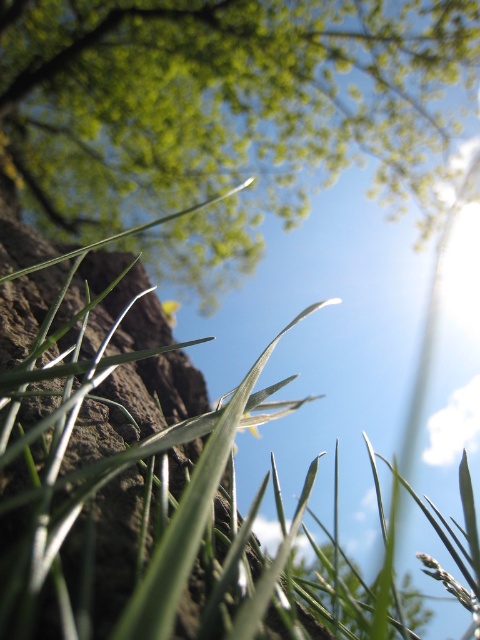
Question: Does green leafy grass at lower left appear on the left side of green leafy tree at center?

Choices:
 (A) no
 (B) yes

Answer: (B)

Question: Which point is closer to the camera?

Choices:
 (A) green leafy tree at center
 (B) green leafy grass at lower left

Answer: (B)

Question: Can you confirm if green leafy grass at lower left is thinner than green leafy tree at center?

Choices:
 (A) yes
 (B) no

Answer: (A)

Question: Which point is farther to the camera?

Choices:
 (A) green leafy tree at center
 (B) green leafy grass at lower left

Answer: (A)

Question: Is green leafy grass at lower left closer to camera compared to green leafy tree at center?

Choices:
 (A) yes
 (B) no

Answer: (A)